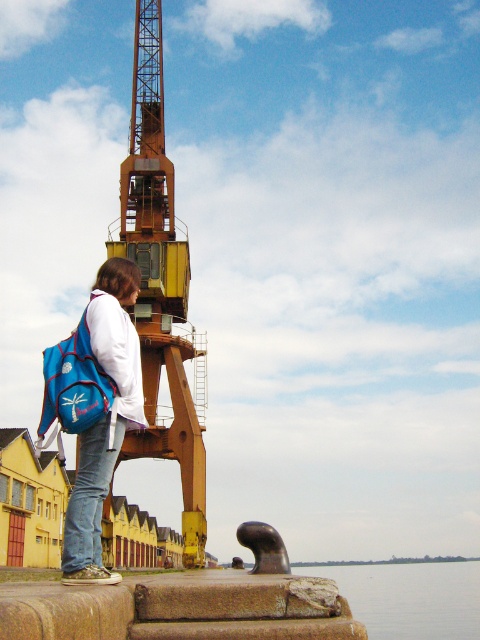
You are a photographer positioned at the camera location. You want to capture a photo of the yellow painted metal crane at center. The crane is 118.91 meters away from you. Your camera has a zoom lens capable of focusing on objects up to 100 meters away. Will you be able to focus on the crane clearly?

The yellow painted metal crane at center is 118.91 meters away from the camera. Since the camera can only focus up to 100 meters, it cannot focus on the crane clearly at this distance.

From the picture: You are standing on the concrete platform and want to place a small item exactly at the point marked by the coordinates point (104, 419). What object is located at that point?

The point (104, 419) marks the location of the blue fabric backpack at center.